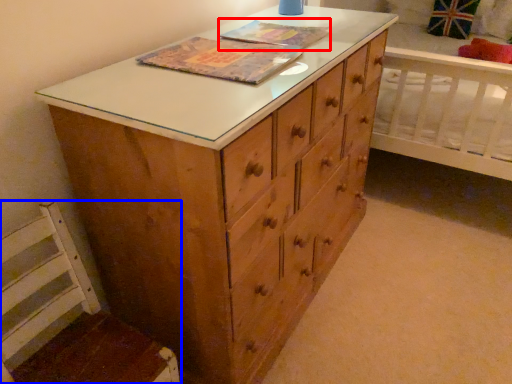
Question: Which of the following is the farthest to the observer, book cover (highlighted by a red box) or swivel chair (highlighted by a blue box)?

Choices:
 (A) book cover
 (B) swivel chair

Answer: (A)